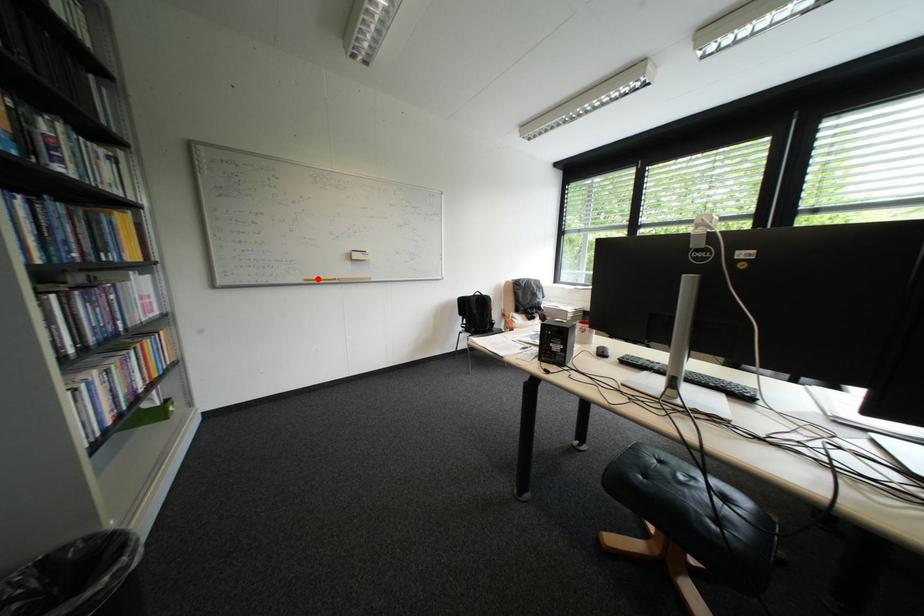
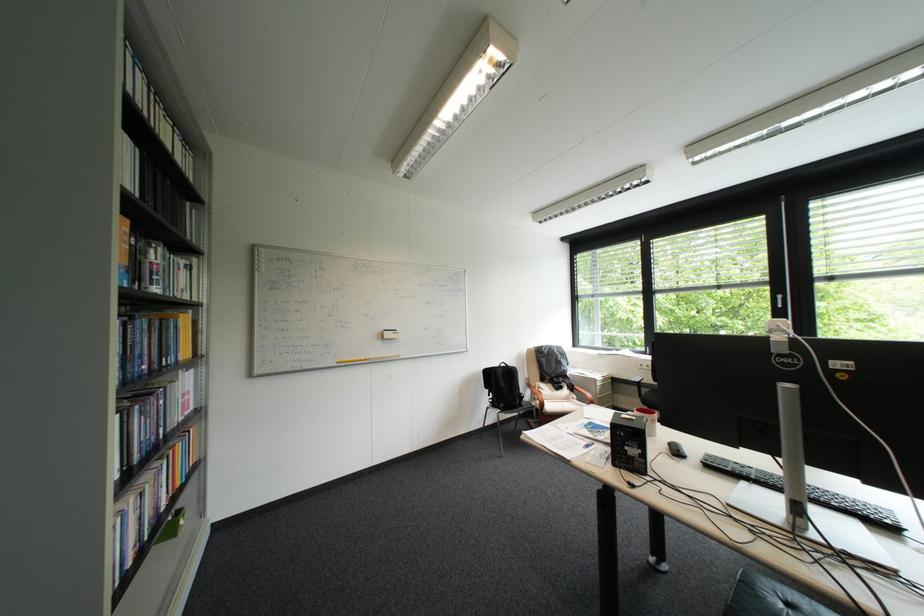
Question: I am providing you with two images of the same scene from different viewpoints. In image1, a red point is highlighted. Considering the same 3D point in image2, which of the following is correct?

Choices:
 (A) It is closer
 (B) It is farther

Answer: (B)